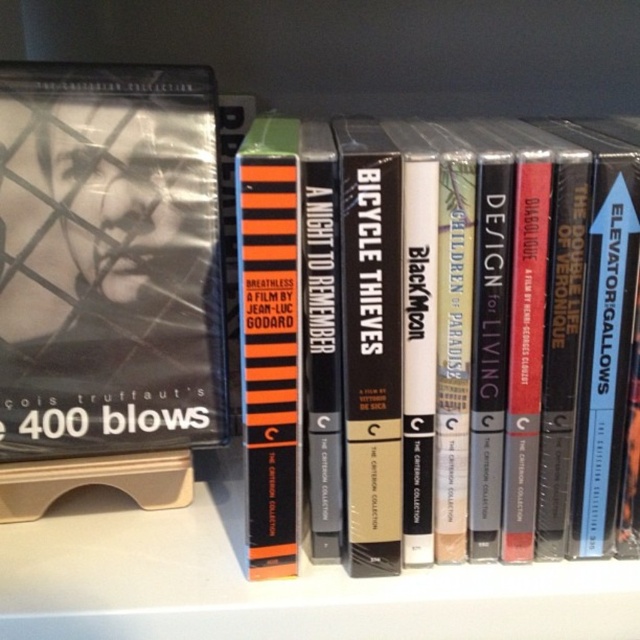
From the picture: You are organizing a library shelf and see the black matte book at center and the orange striped book at center. Which one is closer to you?

The black matte book at center is closer to you because the orange striped book at center is behind it.

What is the spatial position of the black matte book at center in the image?

The black matte book at center is located at point 0.517 on the horizontal axis and 0.731 on the vertical axis.